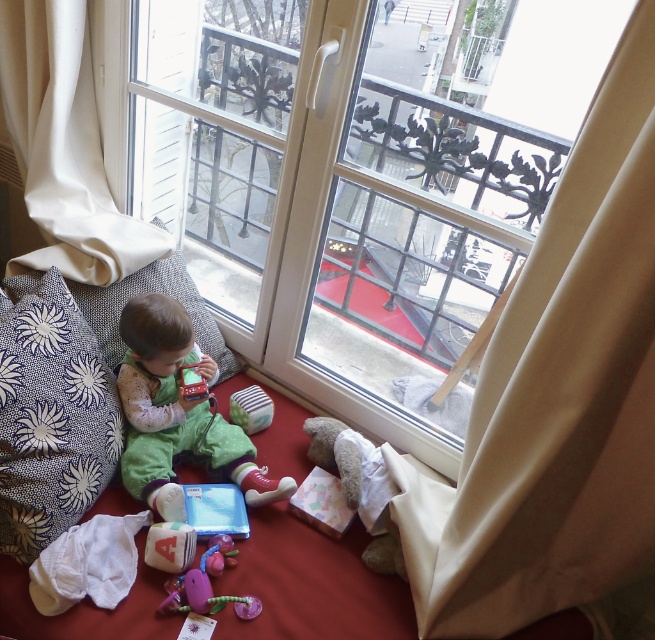
You are a parent trying to find your child who is sitting on the red carpeted floor by the window. You see the blue printed fabric pillow at lower left and the green soft fabric toddler at lower left. Which object is closer to you?

The blue printed fabric pillow at lower left is closer to you because it is in front of the green soft fabric toddler at lower left.

You are a delivery robot standing at the camera position. You need to deliver a package to the point marked as point (x=295, y=364). Can you reach it without moving closer than 2 meters to any obstacles?

The point (x=295, y=364) is 1.81 meters away from the camera, which is within the 2 meter limit. Therefore, the delivery robot cannot reach it without moving closer than 2 meters to any obstacles.